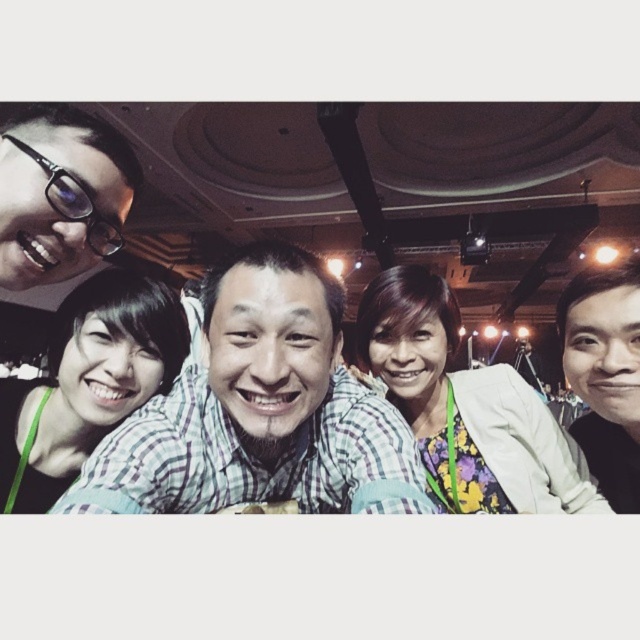
You are standing in front of the group photo and want to locate the checkered fabric shirt at center. According to the coordinates given, where exactly is it positioned in the image?

The checkered fabric shirt at center is positioned at the 2D coordinates point [260,410].

You are a photographer trying to adjust the spacing between the checkered fabric shirt at center and the floral fabric blouse at center to ensure they are at least 40 centimeters apart for better visibility in the group photo. Based on the current distance, is this adjustment necessary?

The checkered fabric shirt at center is currently 36.09 centimeters from the floral fabric blouse at center, which is less than the required 40 centimeters. Therefore, an adjustment is necessary to increase the distance between them for better visibility.